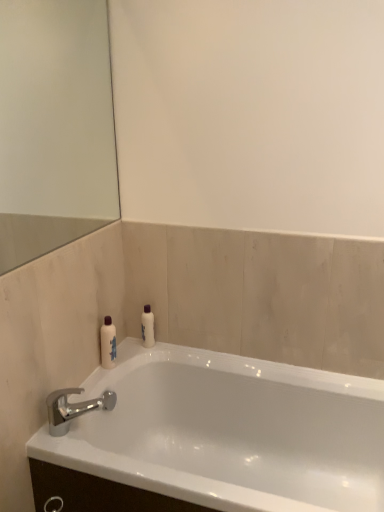
Question: Is chrome metallic faucet at lower left to the left of white glossy bathtub at lower left from the viewer's perspective?

Choices:
 (A) yes
 (B) no

Answer: (A)

Question: Considering the relative sizes of chrome metallic faucet at lower left and white glossy bathtub at lower left in the image provided, is chrome metallic faucet at lower left smaller than white glossy bathtub at lower left?

Choices:
 (A) no
 (B) yes

Answer: (B)

Question: Is chrome metallic faucet at lower left aimed at white glossy bathtub at lower left?

Choices:
 (A) yes
 (B) no

Answer: (B)

Question: From a real-world perspective, does chrome metallic faucet at lower left sit lower than white glossy bathtub at lower left?

Choices:
 (A) no
 (B) yes

Answer: (A)

Question: Is chrome metallic faucet at lower left far away from white glossy bathtub at lower left?

Choices:
 (A) yes
 (B) no

Answer: (B)

Question: Considering the relative positions of white glossy bathtub at lower left and white glossy bottle at upper center, the first toiletry positioned from the right, in the image provided, is white glossy bathtub at lower left to the left or to the right of white glossy bottle at upper center, the first toiletry positioned from the right,?

Choices:
 (A) right
 (B) left

Answer: (A)

Question: Does point (158, 388) appear closer or farther from the camera than point (150, 306)?

Choices:
 (A) closer
 (B) farther

Answer: (A)

Question: Looking at their shapes, would you say white glossy bathtub at lower left is wider or thinner than white glossy bottle at upper center, which ranks as the 2th toiletry in left-to-right order?

Choices:
 (A) wide
 (B) thin

Answer: (A)

Question: Relative to white glossy bottle at upper center, which ranks as the 2th toiletry in left-to-right order, is white glossy bathtub at lower left in front or behind?

Choices:
 (A) front
 (B) behind

Answer: (A)

Question: Would you say white glossy bathtub at lower left is inside or outside white glossy bottle at left, the first toiletry in the left-to-right sequence?

Choices:
 (A) inside
 (B) outside

Answer: (B)

Question: From the image's perspective, is white glossy bathtub at lower left above or below white glossy bottle at left, the 2th toiletry when ordered from right to left?

Choices:
 (A) above
 (B) below

Answer: (B)

Question: From a real-world perspective, relative to white glossy bottle at left, which is the 2th toiletry from back to front, is white glossy bathtub at lower left vertically above or below?

Choices:
 (A) below
 (B) above

Answer: (A)

Question: Is point (258, 499) positioned closer to the camera than point (104, 356)?

Choices:
 (A) farther
 (B) closer

Answer: (B)

Question: From their relative heights in the image, would you say white glossy bottle at left, the 2th toiletry when ordered from right to left, is taller or shorter than white glossy bathtub at lower left?

Choices:
 (A) tall
 (B) short

Answer: (B)

Question: Does point (104, 355) appear closer or farther from the camera than point (177, 449)?

Choices:
 (A) closer
 (B) farther

Answer: (A)